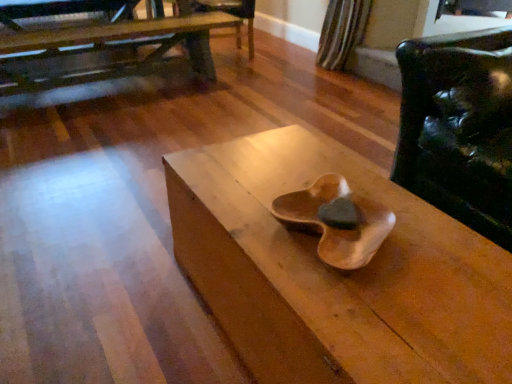
Question: Should I look upward or downward to see glossy leather chair at right?

Choices:
 (A) up
 (B) down

Answer: (A)

Question: Is wooden table at upper left, which ranks as the first table in top-to-bottom order, beside glossy leather chair at right?

Choices:
 (A) yes
 (B) no

Answer: (B)

Question: Is the position of wooden table at upper left, the 2th table positioned from the right, less distant than that of glossy leather chair at right?

Choices:
 (A) no
 (B) yes

Answer: (A)

Question: Considering the relative sizes of wooden table at upper left, positioned as the second table in front-to-back order, and glossy leather chair at right in the image provided, is wooden table at upper left, positioned as the second table in front-to-back order, thinner than glossy leather chair at right?

Choices:
 (A) no
 (B) yes

Answer: (B)

Question: Considering the relative sizes of wooden table at upper left, arranged as the 1th table when viewed from the left, and glossy leather chair at right in the image provided, is wooden table at upper left, arranged as the 1th table when viewed from the left, taller than glossy leather chair at right?

Choices:
 (A) yes
 (B) no

Answer: (B)

Question: Is wooden table at upper left, positioned as the second table in front-to-back order, oriented towards glossy leather chair at right?

Choices:
 (A) no
 (B) yes

Answer: (B)

Question: From the image's perspective, does wooden table at upper left, which appears as the first table when viewed from the back, appear lower than glossy leather chair at right?

Choices:
 (A) yes
 (B) no

Answer: (B)

Question: Does wooden table at upper left, positioned as the second table in front-to-back order, have a lesser width compared to wooden armchair at center?

Choices:
 (A) yes
 (B) no

Answer: (B)

Question: From a real-world perspective, is wooden table at upper left, positioned as the 2th table in bottom-to-top order, physically below wooden armchair at center?

Choices:
 (A) yes
 (B) no

Answer: (B)

Question: Is wooden table at upper left, which ranks as the first table in top-to-bottom order, touching wooden armchair at center?

Choices:
 (A) yes
 (B) no

Answer: (B)

Question: Can you confirm if wooden table at upper left, which ranks as the first table in top-to-bottom order, is wider than wooden armchair at center?

Choices:
 (A) yes
 (B) no

Answer: (A)

Question: Is wooden table at upper left, arranged as the 1th table when viewed from the left, oriented away from wooden armchair at center?

Choices:
 (A) no
 (B) yes

Answer: (A)

Question: Is wooden table at upper left, which ranks as the first table in top-to-bottom order, further to the viewer compared to wooden armchair at center?

Choices:
 (A) no
 (B) yes

Answer: (A)

Question: Is wooden table at upper left, positioned as the 2th table in bottom-to-top order, inside wooden table at center, positioned as the first table in bottom-to-top order?

Choices:
 (A) yes
 (B) no

Answer: (B)